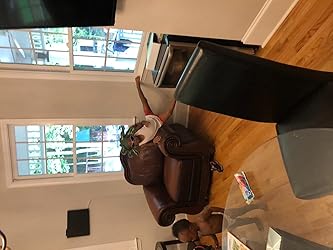
Locate an element on the screen. The height and width of the screenshot is (250, 333). black chair is located at coordinates (310, 109).